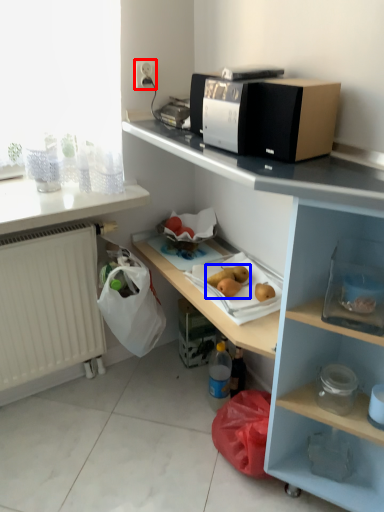
Question: Among these objects, which one is nearest to the camera, electric outlet (highlighted by a red box) or fruit (highlighted by a blue box)?

Choices:
 (A) electric outlet
 (B) fruit

Answer: (B)